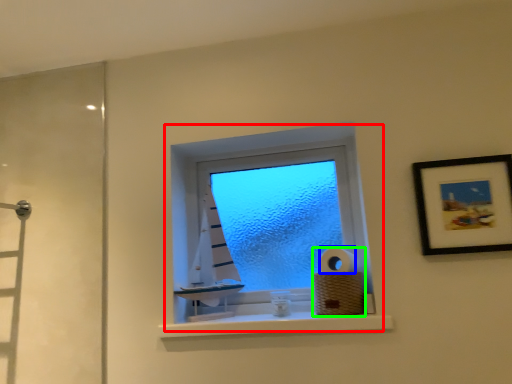
Question: Which is farther away from window (highlighted by a red box)? toilet paper (highlighted by a blue box) or toilet paper (highlighted by a green box)?

Choices:
 (A) toilet paper
 (B) toilet paper

Answer: (A)